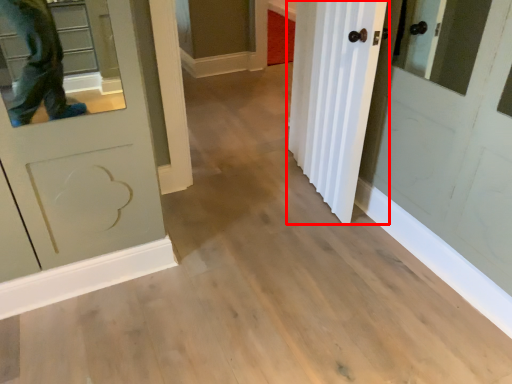
Question: Where is door (annotated by the red box) located in relation to cabinetry in the image?

Choices:
 (A) right
 (B) left

Answer: (A)